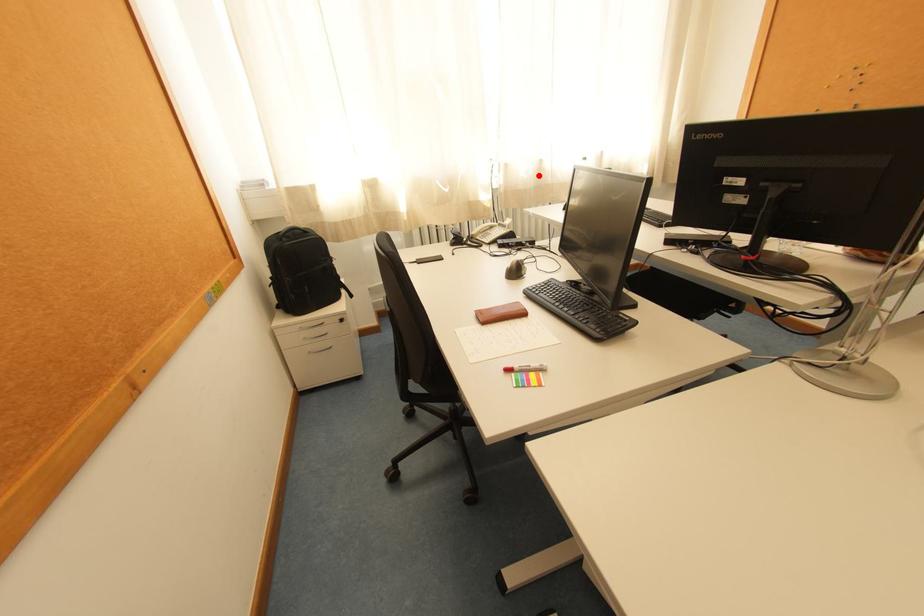
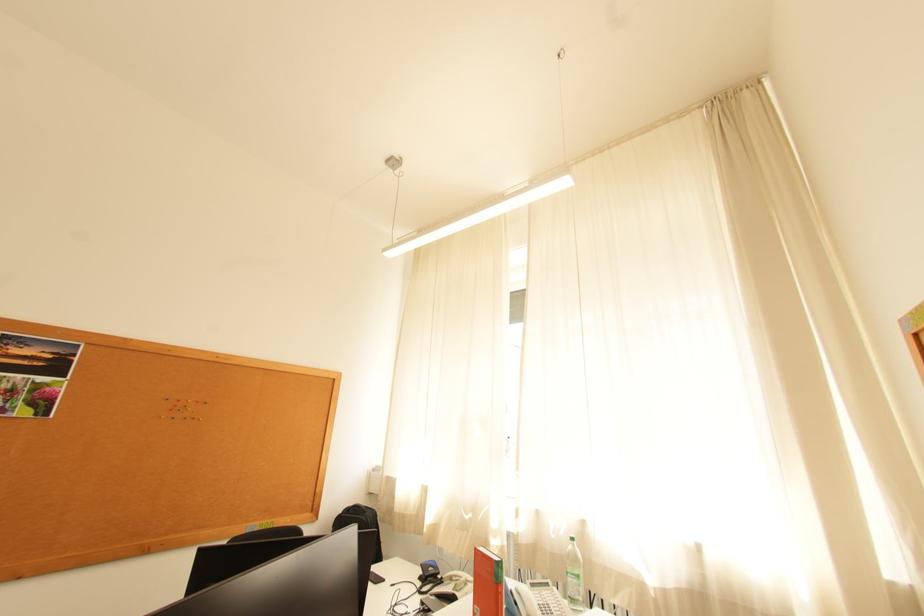
The point at the highlighted location is marked in the first image. Where is the corresponding point in the second image?

(569, 536)